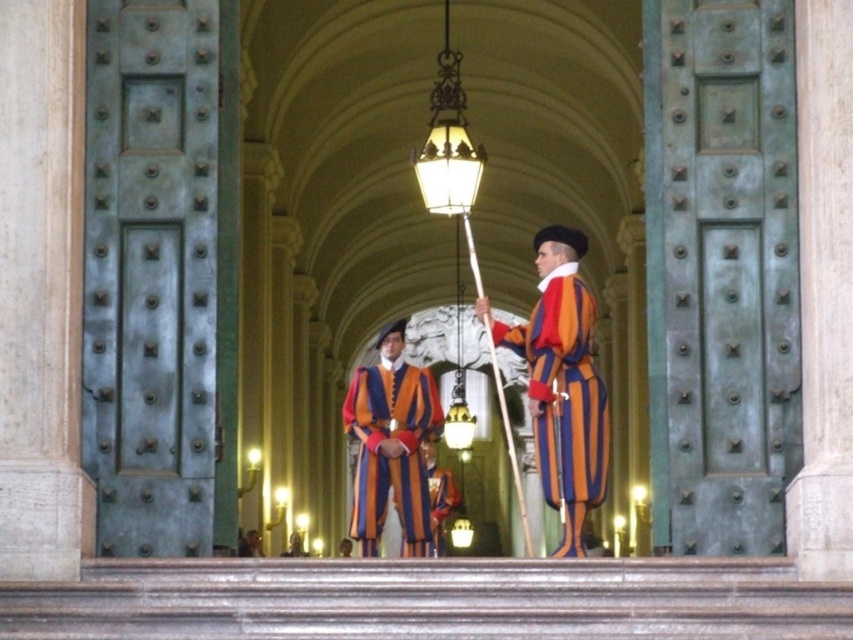
How distant is orange striped fabric at center from orange striped uniform at center?

The distance of orange striped fabric at center from orange striped uniform at center is 25.84 meters.

Is point (579, 310) positioned before point (434, 477)?

Yes, it is.

This screenshot has width=853, height=640. I want to click on orange striped fabric at center, so click(561, 384).

Is point (422, 516) closer to camera compared to point (450, 490)?

Yes, it is.

Can you confirm if striped velvet uniform at center is bigger than orange striped uniform at center?

No.

Find the location of `striped velvet uniform at center`. striped velvet uniform at center is located at coordinates (390, 451).

Who is more distant from viewer, (572,349) or (386,388)?

Positioned behind is point (386,388).

Is orange striped fabric at center shorter than striped velvet uniform at center?

No, orange striped fabric at center is not shorter than striped velvet uniform at center.

Is point (544, 314) positioned after point (372, 422)?

No, it is in front of (372, 422).

Where is `orange striped fabric at center`? The image size is (853, 640). orange striped fabric at center is located at coordinates (561, 384).